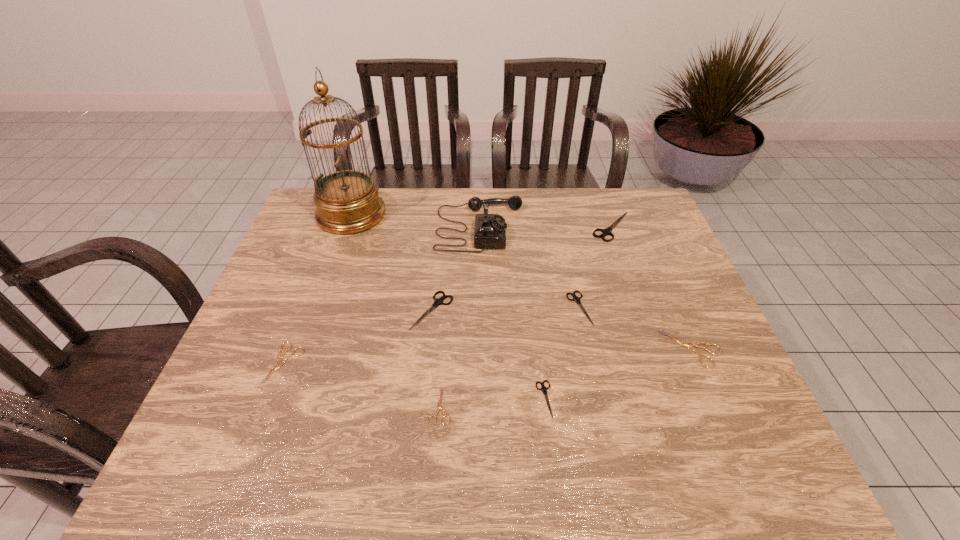
This screenshot has height=540, width=960. In order to click on object that is at the far left corner in this screenshot , I will do `click(347, 201)`.

The height and width of the screenshot is (540, 960). I want to click on object situated at the far right corner, so click(607, 231).

Locate an element on the screen. blank area at the far edge is located at coordinates (471, 215).

At what (x,y) coordinates should I click in order to perform the action: click on free space at the near edge of the desktop. Please return your answer as a coordinate pair (x, y). This screenshot has width=960, height=540. Looking at the image, I should click on (694, 470).

At what (x,y) coordinates should I click in order to perform the action: click on vacant area at the left edge. Please return your answer as a coordinate pair (x, y). This screenshot has height=540, width=960. Looking at the image, I should click on (304, 321).

In the image, there is a desktop. At what (x,y) coordinates should I click in order to perform the action: click on vacant region at the right edge. Please return your answer as a coordinate pair (x, y). The width and height of the screenshot is (960, 540). Looking at the image, I should click on (646, 271).

At what (x,y) coordinates should I click in order to perform the action: click on free space between the smallest beige shears and the seventh shortest object. Please return your answer as a coordinate pair (x, y). Looking at the image, I should click on (526, 316).

This screenshot has width=960, height=540. Identify the location of free space between the rightmost beige shears and the second beige shears from left to right. (565, 377).

At what (x,y) coordinates should I click in order to perform the action: click on free point between the second tallest shears and the third shears from right to left. Please return your answer as a coordinate pair (x, y). Looking at the image, I should click on (506, 309).

At what (x,y) coordinates should I click in order to perform the action: click on free spot between the leftmost shears and the birdcage. Please return your answer as a coordinate pair (x, y). The image size is (960, 540). Looking at the image, I should click on (318, 289).